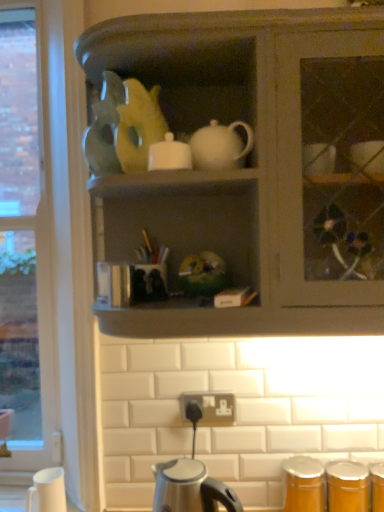
Question: In the image, is matte gray cabinet at center on the left side or the right side of white glossy sugar bowl at upper center?

Choices:
 (A) left
 (B) right

Answer: (B)

Question: From a real-world perspective, is matte gray cabinet at center physically located above or below white glossy sugar bowl at upper center?

Choices:
 (A) above
 (B) below

Answer: (B)

Question: Which of these objects is positioned closest to the white matte coffee cup at lower left?

Choices:
 (A) satin silver kettle at lower center
 (B) matte gray cabinet at center
 (C) matte orange canister at lower right
 (D) white glossy sugar bowl at upper center

Answer: (A)

Question: Which of these objects is positioned closest to the matte gray cabinet at center?

Choices:
 (A) matte orange canister at lower right
 (B) satin silver kettle at lower center
 (C) white glossy sugar bowl at upper center
 (D) white matte coffee cup at lower left

Answer: (C)